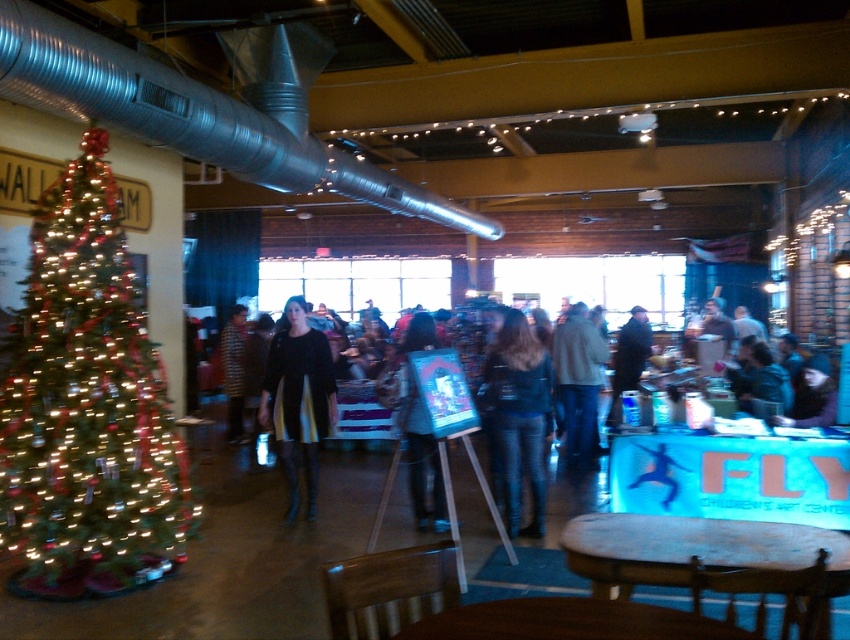
Which is above, black leather jacket at center or wooden table at center?

wooden table at center is above.

Who is taller, black leather jacket at center or wooden table at center?

black leather jacket at center

The height and width of the screenshot is (640, 850). I want to click on black leather jacket at center, so click(x=728, y=477).

Find the location of a particular element. Image resolution: width=850 pixels, height=640 pixels. black leather jacket at center is located at coordinates (728, 477).

Can you confirm if black matte dress at center is thinner than matte black jacket at center?

Indeed, black matte dress at center has a lesser width compared to matte black jacket at center.

Who is taller, black matte dress at center or matte black jacket at center?

black matte dress at center is taller.

Between point (312, 476) and point (401, 410), which one is positioned in front?

Point (401, 410)

Identify the location of black matte dress at center. (298, 400).

Does point (439, 516) come closer to viewer compared to point (586, 336)?

Yes, it is in front of point (586, 336).

Which is more to the right, matte black jacket at center or light brown leather jacket at center?

light brown leather jacket at center

Is point (416, 426) positioned after point (582, 390)?

No, (416, 426) is in front of (582, 390).

At what (x,y) coordinates should I click in order to perform the action: click on matte black jacket at center. Please return your answer as a coordinate pair (x, y). The image size is (850, 640). Looking at the image, I should click on (x=415, y=420).